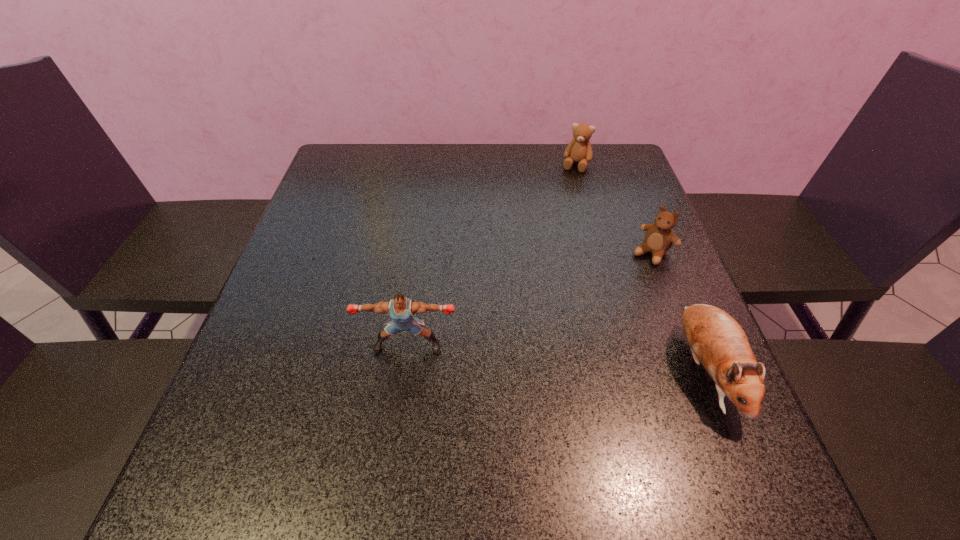
At what (x,y) coordinates should I click in order to perform the action: click on vacant space on the desktop that is between the tallest object and the hamster and is positioned on the front-facing side of the second farthest object. Please return your answer as a coordinate pair (x, y). Looking at the image, I should click on coord(559,359).

Where is `free space on the desktop that is between the leftmost object and the hamster and is positioned on the face of the farther teddy bear`? free space on the desktop that is between the leftmost object and the hamster and is positioned on the face of the farther teddy bear is located at coordinates (509, 354).